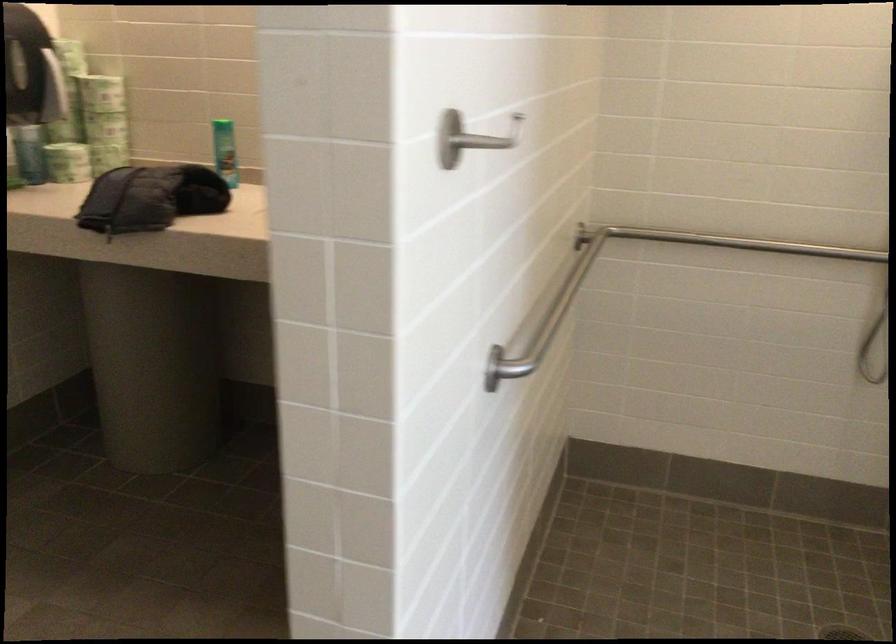
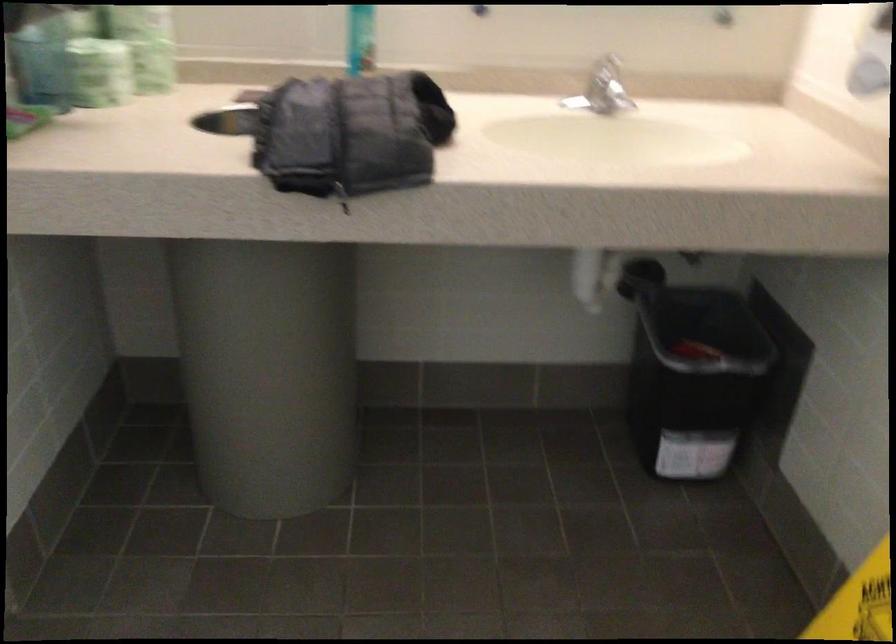
Find the pixel in the second image that matches (140,196) in the first image.

(350, 134)